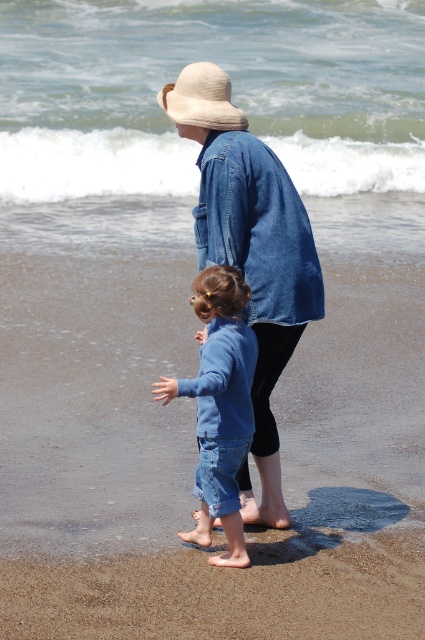
Question: Which of these objects is positioned farthest from the blue denim jeans at center?

Choices:
 (A) beige woven hat at upper center
 (B) denim jacket at center

Answer: (A)

Question: Can you confirm if denim jacket at center is positioned to the right of beige woven hat at upper center?

Choices:
 (A) no
 (B) yes

Answer: (B)

Question: Can you confirm if denim jacket at center is smaller than beige woven hat at upper center?

Choices:
 (A) yes
 (B) no

Answer: (B)

Question: Among these points, which one is farthest from the camera?

Choices:
 (A) (248, 369)
 (B) (215, 72)
 (C) (274, 456)

Answer: (C)

Question: Is blue denim jeans at center smaller than beige woven hat at upper center?

Choices:
 (A) yes
 (B) no

Answer: (B)

Question: Estimate the real-world distances between objects in this image. Which object is farther from the blue denim jeans at center?

Choices:
 (A) denim jacket at center
 (B) beige woven hat at upper center

Answer: (B)